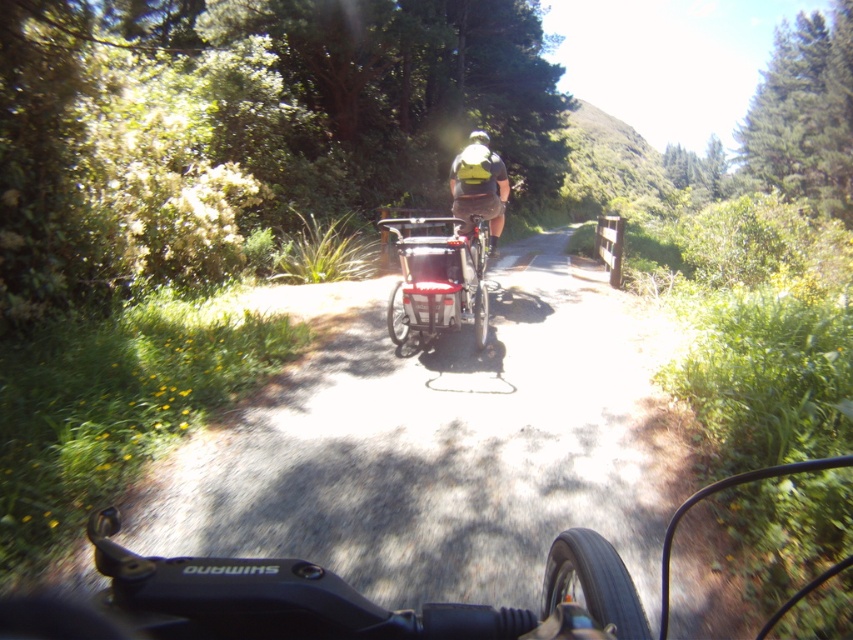
Between point (469, 268) and point (463, 216), which one is positioned in front?

Point (469, 268) is more forward.

What do you see at coordinates (438, 276) in the screenshot?
I see `metallic silver bicycle at center` at bounding box center [438, 276].

This screenshot has height=640, width=853. What are the coordinates of `metallic silver bicycle at center` in the screenshot? It's located at (438, 276).

Identify the location of metallic silver bicycle at center. click(x=438, y=276).

Is smooth asphalt road at center above yellow fabric backpack at center?

No, smooth asphalt road at center is not above yellow fabric backpack at center.

Is smooth asphalt road at center wider than yellow fabric backpack at center?

Yes.

Between point (635, 417) and point (498, 173), which one is positioned behind?

The point (498, 173) is behind.

Locate an element on the screen. The image size is (853, 640). smooth asphalt road at center is located at coordinates (438, 451).

At what (x,y) coordinates should I click in order to perform the action: click on metallic silver bicycle at center. Please return your answer as a coordinate pair (x, y). This screenshot has width=853, height=640. Looking at the image, I should click on (438, 276).

Which is above, metallic silver bicycle at center or white matte bicycle helmet at upper center?

Positioned higher is white matte bicycle helmet at upper center.

Identify the location of metallic silver bicycle at center. The height and width of the screenshot is (640, 853). (438, 276).